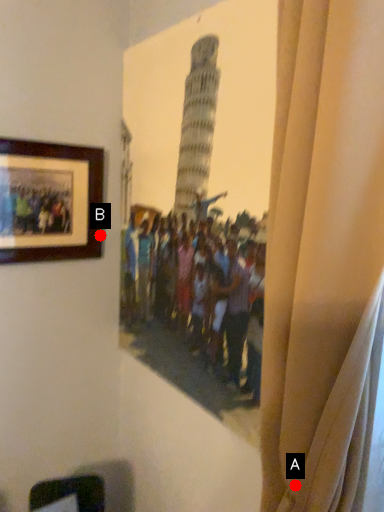
Question: Two points are circled on the image, labeled by A and B beside each circle. Which point appears farthest from the camera in this image?

Choices:
 (A) A is further
 (B) B is further

Answer: (B)